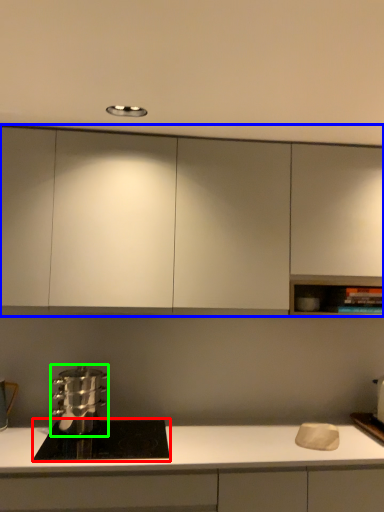
Question: Estimate the real-world distances between objects in this image. Which object is closer to home appliance (highlighted by a red box), cabinetry (highlighted by a blue box) or kitchen appliance (highlighted by a green box)?

Choices:
 (A) cabinetry
 (B) kitchen appliance

Answer: (B)